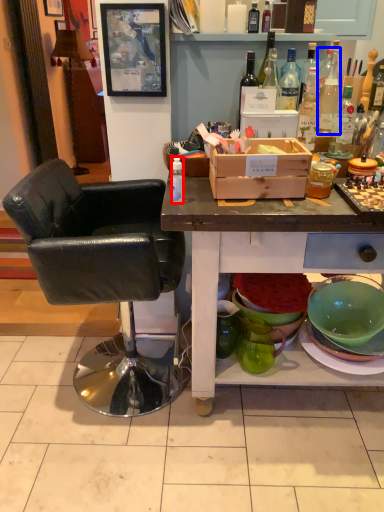
Question: Which object is further to the camera taking this photo, bottle (highlighted by a red box) or bottle (highlighted by a blue box)?

Choices:
 (A) bottle
 (B) bottle

Answer: (B)